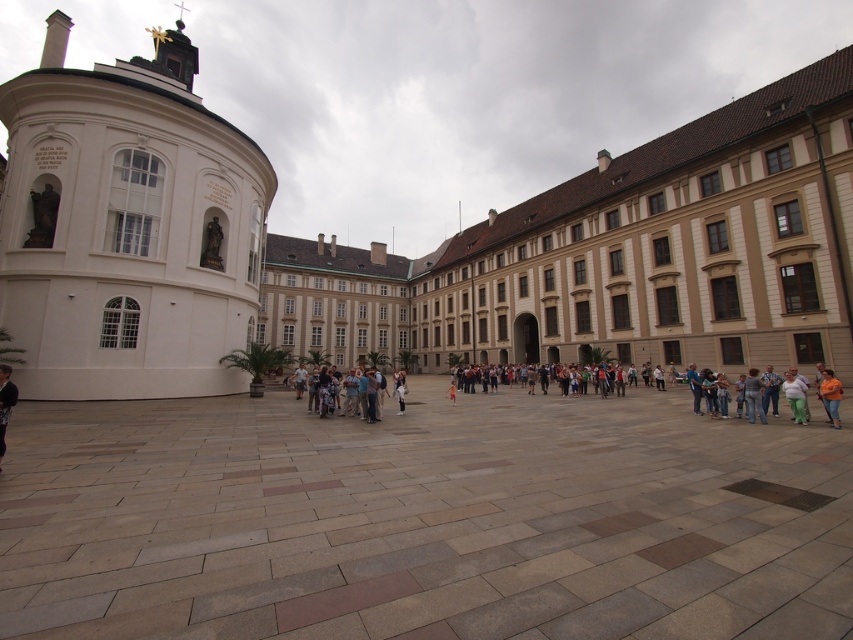
The height and width of the screenshot is (640, 853). Describe the element at coordinates (4, 403) in the screenshot. I see `dark blue jeans at lower left` at that location.

Where is `dark blue jeans at lower left`? dark blue jeans at lower left is located at coordinates (4, 403).

Locate an element on the screen. Image resolution: width=853 pixels, height=640 pixels. dark blue jeans at lower left is located at coordinates (4, 403).

Is smooth stone courtyard at center smaller than white smooth dome at left?

Yes.

Based on the photo, is smooth stone courtyard at center bigger than white smooth dome at left?

No.

Between point (645, 632) and point (228, 333), which one is positioned in front?

Positioned in front is point (645, 632).

The width and height of the screenshot is (853, 640). In order to click on smooth stone courtyard at center in this screenshot , I will do `click(422, 520)`.

Does light brown leather jacket at center appear under orange cotton shirt at lower right?

Indeed, light brown leather jacket at center is positioned under orange cotton shirt at lower right.

Does light brown leather jacket at center lie behind orange cotton shirt at lower right?

Yes.

The height and width of the screenshot is (640, 853). What do you see at coordinates (366, 390) in the screenshot?
I see `light brown leather jacket at center` at bounding box center [366, 390].

The height and width of the screenshot is (640, 853). Identify the location of light brown leather jacket at center. [366, 390].